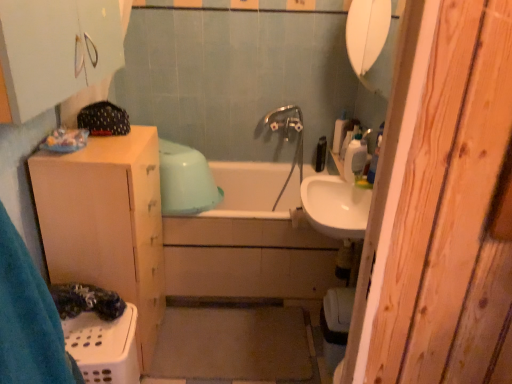
Locate an element on the screen. The width and height of the screenshot is (512, 384). chrome metallic faucet at center is located at coordinates (288, 137).

What do you see at coordinates (248, 241) in the screenshot?
I see `white ceramic bathtub at center` at bounding box center [248, 241].

What do you see at coordinates (59, 51) in the screenshot? I see `white matte cabinet at upper left` at bounding box center [59, 51].

The image size is (512, 384). What are the coordinates of `white plastic bottle at upper right, which is the 2th toiletry in front-to-back order` in the screenshot? It's located at (339, 133).

Image resolution: width=512 pixels, height=384 pixels. Describe the element at coordinates (104, 347) in the screenshot. I see `white plastic laundry basket at lower left` at that location.

Identify the location of chrome metallic faucet at center. This screenshot has width=512, height=384. (288, 137).

Is white plastic soap dispenser at upper right outside of chrome metallic faucet at center?

Yes.

Between white plastic soap dispenser at upper right and chrome metallic faucet at center, which one has larger width?

chrome metallic faucet at center is wider.

Is point (356, 152) in front of point (284, 117)?

Yes.

Is white ceramic bathtub at center completely or partially inside white plastic laundry basket at lower left?

No, white plastic laundry basket at lower left does not contain white ceramic bathtub at center.

Is white plastic laundry basket at lower left aimed at white ceramic bathtub at center?

No, white plastic laundry basket at lower left is not turned towards white ceramic bathtub at center.

Considering the relative positions of white plastic laundry basket at lower left and white ceramic bathtub at center in the image provided, is white plastic laundry basket at lower left to the left or to the right of white ceramic bathtub at center?

From the image, it's evident that white plastic laundry basket at lower left is to the left of white ceramic bathtub at center.

Which object is wider, white plastic laundry basket at lower left or white ceramic bathtub at center?

Wider between the two is white ceramic bathtub at center.

Is black plastic bottle at upper center, the third toiletry viewed from the front, oriented away from matte white cabinet at left?

No.

From a real-world perspective, is black plastic bottle at upper center, which is the 1th toiletry from back to front, over matte white cabinet at left?

Yes.

Is the depth of black plastic bottle at upper center, which is the 1th toiletry from back to front, less than that of matte white cabinet at left?

No, the depth of black plastic bottle at upper center, which is the 1th toiletry from back to front, is greater than that of matte white cabinet at left.

Image resolution: width=512 pixels, height=384 pixels. I want to click on bathroom cabinet below the black plastic bottle at upper center, which is the 1th toiletry from back to front (from the image's perspective), so click(x=106, y=222).

Is white glossy sink at center looking in the opposite direction of chrome metallic faucet at center?

white glossy sink at center does not have its back to chrome metallic faucet at center.

Locate an element on the screen. The image size is (512, 384). plumbing fixture that appears below the white glossy sink at center (from a real-world perspective) is located at coordinates (288, 137).

In the image, is white glossy sink at center on the left side or the right side of chrome metallic faucet at center?

white glossy sink at center is to the right of chrome metallic faucet at center.

Which point is more forward, (325, 224) or (302, 139)?

Point (325, 224)

Identify the location of bathroom cabinet lying on the left of white glossy sink at center. (106, 222).

From the image's perspective, relative to matte white cabinet at left, is white glossy sink at center above or below?

white glossy sink at center is situated higher than matte white cabinet at left in the image.

Are white glossy sink at center and matte white cabinet at left far apart?

Result: white glossy sink at center is actually quite close to matte white cabinet at left.

Is there a large distance between white plastic container at upper right, marked as the 3th toiletry in a back-to-front arrangement, and black plastic bottle at upper center, the third toiletry viewed from the front?

No, white plastic container at upper right, marked as the 3th toiletry in a back-to-front arrangement, is not far from black plastic bottle at upper center, the third toiletry viewed from the front.

Which of these two, white plastic container at upper right, the 1th toiletry positioned from the front, or black plastic bottle at upper center, which is the 1th toiletry from back to front, stands taller?

black plastic bottle at upper center, which is the 1th toiletry from back to front.

Is white plastic container at upper right, marked as the 3th toiletry in a back-to-front arrangement, inside or outside of black plastic bottle at upper center, the third toiletry viewed from the front?

white plastic container at upper right, marked as the 3th toiletry in a back-to-front arrangement, is not inside black plastic bottle at upper center, the third toiletry viewed from the front, it's outside.

From a real-world perspective, between white plastic container at upper right, marked as the 3th toiletry in a back-to-front arrangement, and black plastic bottle at upper center, the third toiletry viewed from the front, who is vertically higher?

white plastic container at upper right, marked as the 3th toiletry in a back-to-front arrangement, from a real-world perspective.

Is the surface of white matte cabinet at upper left in direct contact with white ceramic bathtub at center?

white matte cabinet at upper left is not next to white ceramic bathtub at center, and they're not touching.

Is white matte cabinet at upper left smaller than white ceramic bathtub at center?

Yes.

Is white matte cabinet at upper left positioned before white ceramic bathtub at center?

That is True.

Is white matte cabinet at upper left turned away from white ceramic bathtub at center?

No, white matte cabinet at upper left's orientation is not away from white ceramic bathtub at center.

Locate an element on the screen. plumbing fixture that is on the left side of white plastic soap dispenser at upper right is located at coordinates click(x=288, y=137).

Identify the location of laundry basket below the white ceramic bathtub at center (from a real-world perspective). (104, 347).

Considering their positions, is white plastic soap dispenser at upper right positioned closer to white plastic bottle at upper right, which is the 2th toiletry in front-to-back order, than chrome metallic faucet at center?

chrome metallic faucet at center is closer to white plastic bottle at upper right, which is the 2th toiletry in front-to-back order.

From the image, which object appears to be farther from matte white cabinet at left, white ceramic bathtub at center or white plastic soap dispenser at upper right?

white plastic soap dispenser at upper right is positioned further to the anchor matte white cabinet at left.

From the image, which object appears to be nearer to white glossy sink at center, white plastic soap dispenser at upper right or white plastic laundry basket at lower left?

white plastic soap dispenser at upper right is positioned closer to the anchor white glossy sink at center.

Which object lies nearer to the anchor point white plastic laundry basket at lower left, matte white cabinet at left or black plastic bottle at upper center, the third toiletry viewed from the front?

Based on the image, matte white cabinet at left appears to be nearer to white plastic laundry basket at lower left.

Which object lies nearer to the anchor point white plastic bottle at upper right, which is the 2th toiletry in front-to-back order, white ceramic bathtub at center or matte white cabinet at left?

Based on the image, white ceramic bathtub at center appears to be nearer to white plastic bottle at upper right, which is the 2th toiletry in front-to-back order.

Considering their positions, is black plastic bottle at upper center, which is the 1th toiletry from back to front, positioned further to white glossy sink at center than white ceramic bathtub at center?

The object further to white glossy sink at center is black plastic bottle at upper center, which is the 1th toiletry from back to front.

When comparing their distances from chrome metallic faucet at center, does white plastic soap dispenser at upper right or white plastic container at upper right, the 1th toiletry positioned from the front, seem closer?

white plastic container at upper right, the 1th toiletry positioned from the front, is positioned closer to the anchor chrome metallic faucet at center.

When comparing their distances from white plastic soap dispenser at upper right, does white ceramic bathtub at center or matte white cabinet at left seem further?

matte white cabinet at left is further to white plastic soap dispenser at upper right.

You are a GUI agent. You are given a task and a screenshot of the screen. Output one action in this format:
    pyautogui.click(x=<x>, y=<y>)
    Task: Click on the plumbing fixture between matte white cabinet at left and white plastic container at upper right, the 1th toiletry positioned from the front, in the horizontal direction
    This screenshot has width=512, height=384.
    Given the screenshot: What is the action you would take?
    pyautogui.click(x=288, y=137)

The height and width of the screenshot is (384, 512). Find the location of `toiletry situated between white ceramic bathtub at center and white plastic bottle at upper right, which ranks as the second toiletry in back-to-front order, from left to right`. toiletry situated between white ceramic bathtub at center and white plastic bottle at upper right, which ranks as the second toiletry in back-to-front order, from left to right is located at coordinates (321, 154).

The image size is (512, 384). Find the location of `sink between white plastic laundry basket at lower left and white plastic bottle at upper right, which ranks as the second toiletry in back-to-front order, from left to right`. sink between white plastic laundry basket at lower left and white plastic bottle at upper right, which ranks as the second toiletry in back-to-front order, from left to right is located at coordinates (336, 206).

Find the location of a particular element. This screenshot has width=512, height=384. bathroom cabinet between white matte cabinet at upper left and white plastic container at upper right, the 1th toiletry positioned from the front, from front to back is located at coordinates (106, 222).